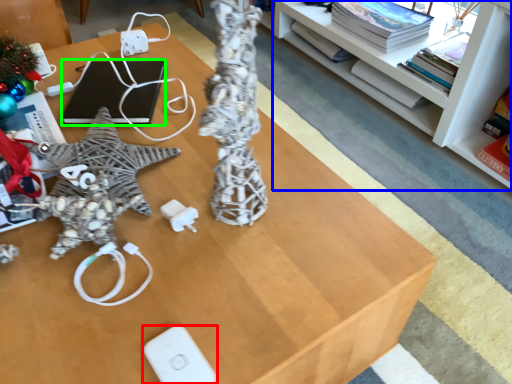
Question: Which is farther away from Wii controller (highlighted by a red box)? shelf (highlighted by a blue box) or laptop (highlighted by a green box)?

Choices:
 (A) shelf
 (B) laptop

Answer: (A)